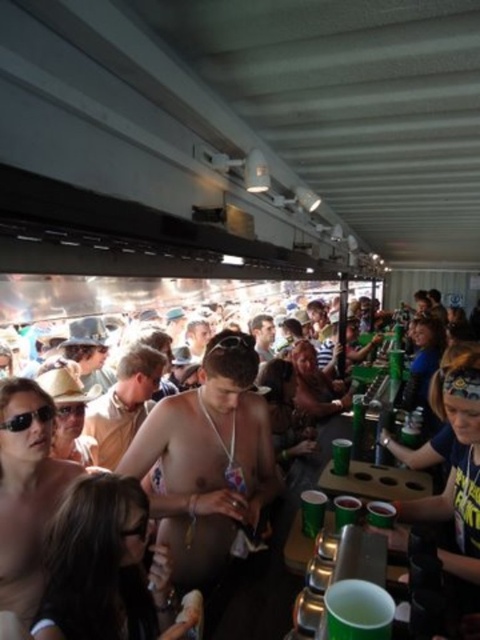
You are a photographer at the music festival. You want to take a portrait of a person in the crowd. The person has both the nude skin at center and black plastic sunglasses at center. Where should you position your camera to capture both features clearly in the same frame?

Position your camera so that it can capture the nude skin at center below the black plastic sunglasses at center, ensuring both elements are visible in the frame.

You are at the music festival and want to know if the green plastic cup at lower center can fit inside the black plastic sunglasses at center. Based on their sizes, what do you think?

The green plastic cup at lower center is much taller than the black plastic sunglasses at center, so it cannot fit inside.

You are at the music festival and want to place your black plastic sunglasses at center on top of the green plastic cup at lower center. Will the sunglasses fit on the cup without falling off?

The green plastic cup at lower center is larger in size than black plastic sunglasses at center, so the sunglasses will fit on top of the cup without falling off.